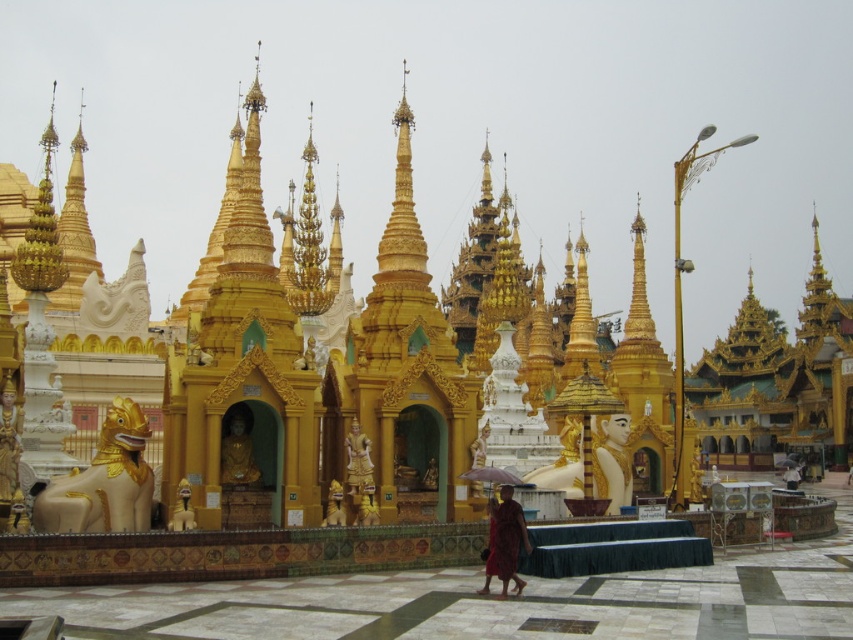
Question: Does gold leaf statue at center come behind smooth beige statue at center?

Choices:
 (A) no
 (B) yes

Answer: (A)

Question: Can you confirm if red monk at center is positioned above gold polished statue at center?

Choices:
 (A) no
 (B) yes

Answer: (A)

Question: Which object is the closest to the smooth beige statue at center?

Choices:
 (A) golden polished statue at lower left
 (B) red monk at center
 (C) gold polished statue at center

Answer: (C)

Question: Does golden polished statue at lower left appear on the left side of smooth beige statue at center?

Choices:
 (A) no
 (B) yes

Answer: (B)

Question: Estimate the real-world distances between objects in this image. Which object is closer to the smooth beige statue at center?

Choices:
 (A) golden polished statue at lower left
 (B) gold leaf statue at center
 (C) gold polished statue at center
 (D) red monk at center

Answer: (B)

Question: Based on their relative distances, which object is farther from the smooth beige statue at center?

Choices:
 (A) gold leaf statue at center
 (B) golden polished statue at lower left
 (C) red monk at center

Answer: (B)